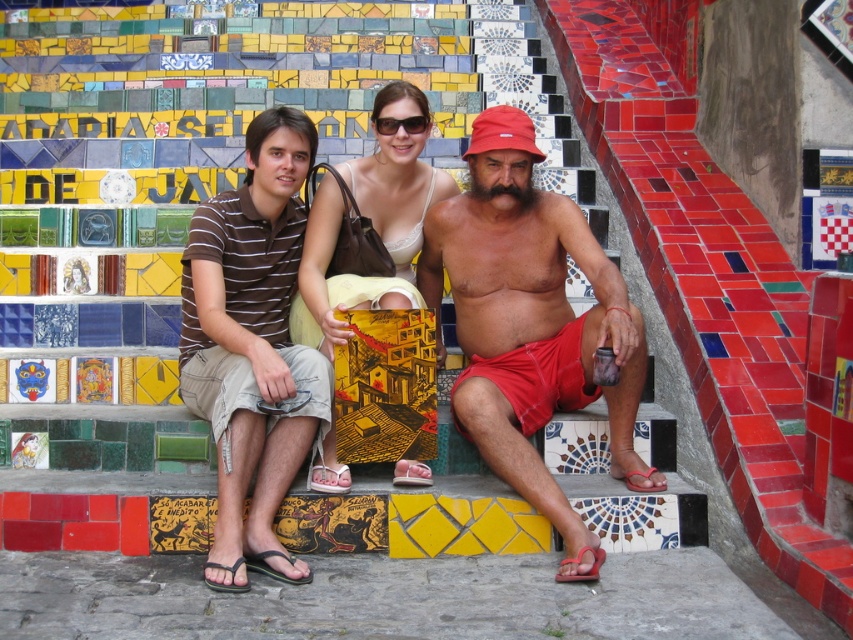
Question: Which point is closer to the camera?

Choices:
 (A) (625, 428)
 (B) (511, 212)
 (C) (326, 176)

Answer: (A)

Question: Where is matte brown shirt at center located in relation to matte beige dress at center in the image?

Choices:
 (A) below
 (B) above

Answer: (A)

Question: Which point is closer to the camera taking this photo?

Choices:
 (A) (219, 493)
 (B) (328, 296)
 (C) (410, 122)

Answer: (A)

Question: Is matte red shorts at center to the right of matte beige dress at center from the viewer's perspective?

Choices:
 (A) yes
 (B) no

Answer: (A)

Question: Can you confirm if brown striped shirt at left is bigger than sunglasses at center?

Choices:
 (A) yes
 (B) no

Answer: (A)

Question: Which of the following is the closest to the observer?

Choices:
 (A) sunglasses at center
 (B) matte beige dress at center
 (C) matte brown shirt at center

Answer: (C)